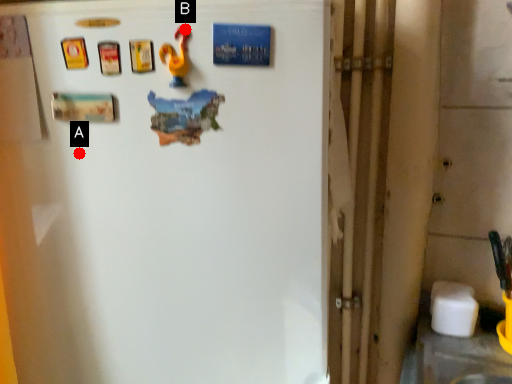
Question: Two points are circled on the image, labeled by A and B beside each circle. Which point appears farthest from the camera in this image?

Choices:
 (A) A is further
 (B) B is further

Answer: (A)